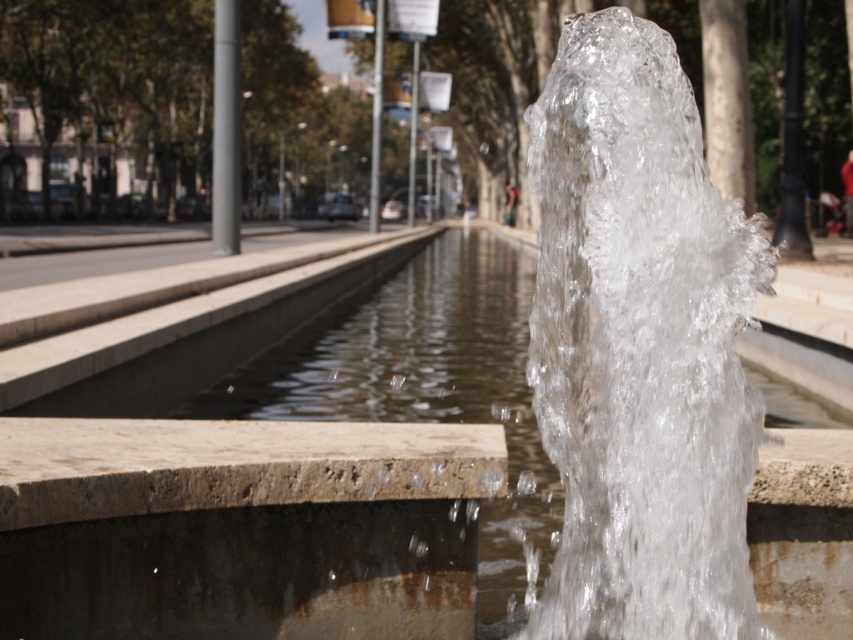
Question: Which point is farther from the camera taking this photo?

Choices:
 (A) coord(573,596)
 (B) coord(439,305)

Answer: (B)

Question: Which point appears closest to the camera in this image?

Choices:
 (A) (639, 132)
 (B) (796, 392)

Answer: (A)

Question: Which point is closer to the camera?

Choices:
 (A) clear liquid water at center
 (B) clear water at center

Answer: (A)

Question: Considering the relative positions of clear liquid water at center and clear water at center in the image provided, where is clear liquid water at center located with respect to clear water at center?

Choices:
 (A) right
 (B) left

Answer: (B)

Question: Does clear liquid water at center have a greater width compared to clear water at center?

Choices:
 (A) yes
 (B) no

Answer: (B)

Question: Is clear liquid water at center to the right of clear water at center from the viewer's perspective?

Choices:
 (A) no
 (B) yes

Answer: (A)